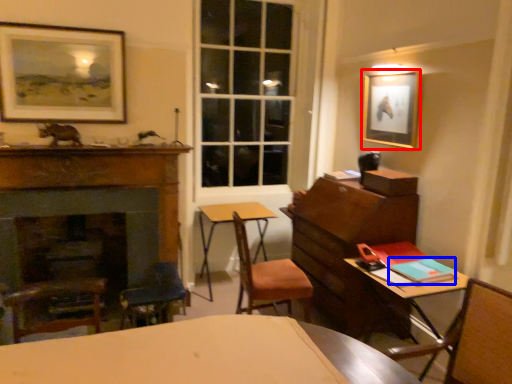
Question: Which point is closer to the camera, picture frame (highlighted by a red box) or book (highlighted by a blue box)?

Choices:
 (A) picture frame
 (B) book

Answer: (B)